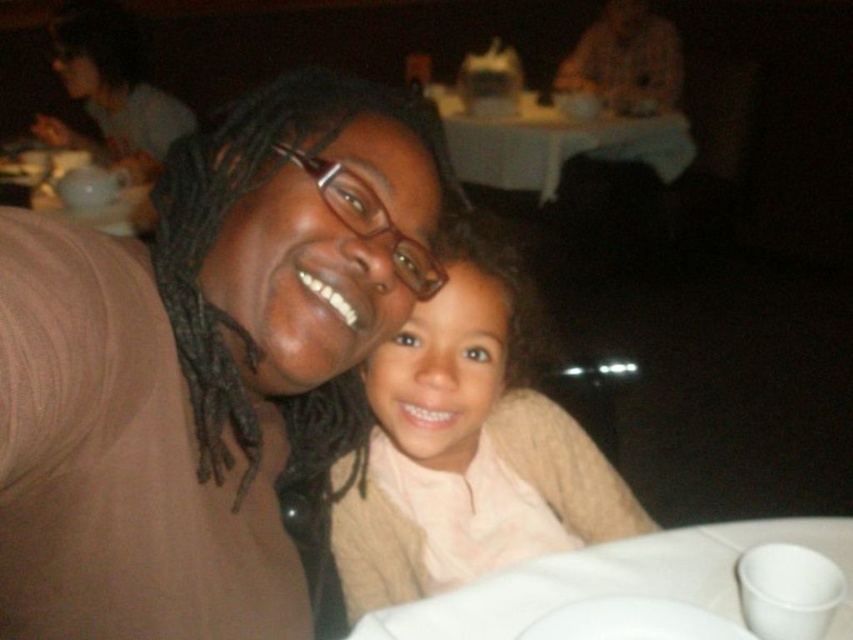
Question: Can you confirm if matte brown sweater at center is wider than white matte plate at lower center?

Choices:
 (A) no
 (B) yes

Answer: (B)

Question: Which object is positioned closest to the matte brown sweater at center?

Choices:
 (A) smooth beige sweater at center
 (B) white matte plate at lower center
 (C) white paper plate at lower center
 (D) white cloth table at upper center

Answer: (A)

Question: Does matte brown sweater at center have a lesser width compared to white paper plate at lower center?

Choices:
 (A) no
 (B) yes

Answer: (B)

Question: Which of these objects is positioned farthest from the matte brown sweater at center?

Choices:
 (A) smooth beige sweater at center
 (B) white paper plate at lower center
 (C) white matte plate at lower center

Answer: (C)

Question: Which of the following is the closest to the observer?

Choices:
 (A) (44, 438)
 (B) (619, 628)

Answer: (A)

Question: Can you confirm if matte brown sweater at center is wider than white matte plate at lower center?

Choices:
 (A) yes
 (B) no

Answer: (A)